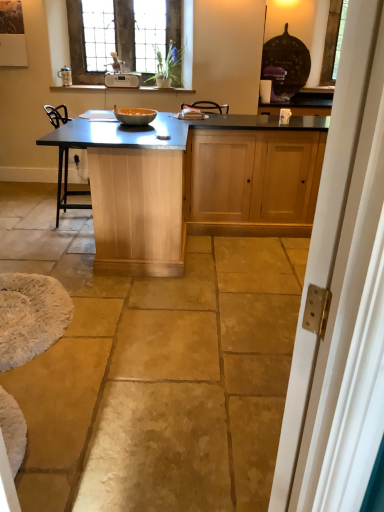
Question: Considering the relative sizes of white fluffy rug at lower left and matte wood table at center in the image provided, is white fluffy rug at lower left smaller than matte wood table at center?

Choices:
 (A) no
 (B) yes

Answer: (B)

Question: Considering the relative sizes of white fluffy rug at lower left and matte wood table at center in the image provided, is white fluffy rug at lower left thinner than matte wood table at center?

Choices:
 (A) no
 (B) yes

Answer: (B)

Question: From a real-world perspective, is white fluffy rug at lower left physically above matte wood table at center?

Choices:
 (A) no
 (B) yes

Answer: (A)

Question: Is the position of white fluffy rug at lower left less distant than that of matte wood table at center?

Choices:
 (A) no
 (B) yes

Answer: (B)

Question: Can you confirm if white fluffy rug at lower left is shorter than matte wood table at center?

Choices:
 (A) no
 (B) yes

Answer: (B)

Question: Could you tell me if white fluffy rug at lower left is facing matte wood table at center?

Choices:
 (A) yes
 (B) no

Answer: (B)

Question: Is matte wood table at center located within matte orange bowl at center?

Choices:
 (A) yes
 (B) no

Answer: (B)

Question: Is matte orange bowl at center oriented towards matte wood table at center?

Choices:
 (A) no
 (B) yes

Answer: (A)

Question: Is matte orange bowl at center next to matte wood table at center?

Choices:
 (A) no
 (B) yes

Answer: (A)

Question: From the image's perspective, is matte orange bowl at center on top of matte wood table at center?

Choices:
 (A) no
 (B) yes

Answer: (B)

Question: Can you confirm if matte orange bowl at center is smaller than matte wood table at center?

Choices:
 (A) no
 (B) yes

Answer: (B)

Question: Can you confirm if matte orange bowl at center is taller than matte wood table at center?

Choices:
 (A) yes
 (B) no

Answer: (B)

Question: Considering the relative positions of white fluffy rug at lower left and matte orange bowl at center in the image provided, is white fluffy rug at lower left to the left of matte orange bowl at center from the viewer's perspective?

Choices:
 (A) yes
 (B) no

Answer: (A)